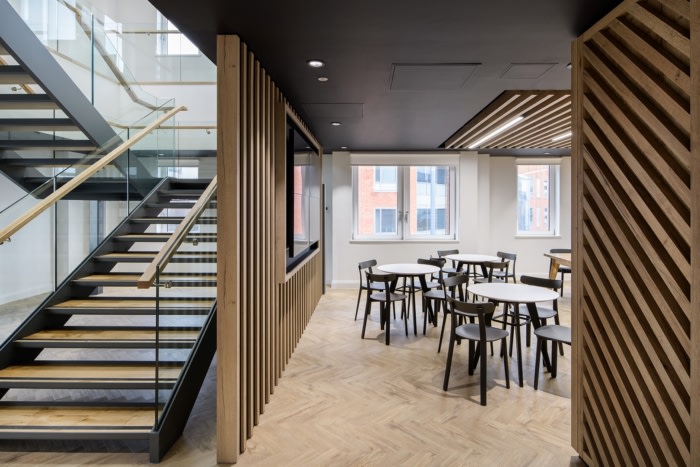
Image resolution: width=700 pixels, height=467 pixels. What are the coordinates of `round and rectangular table` in the screenshot? It's located at (411, 267), (466, 256), (521, 291), (561, 253).